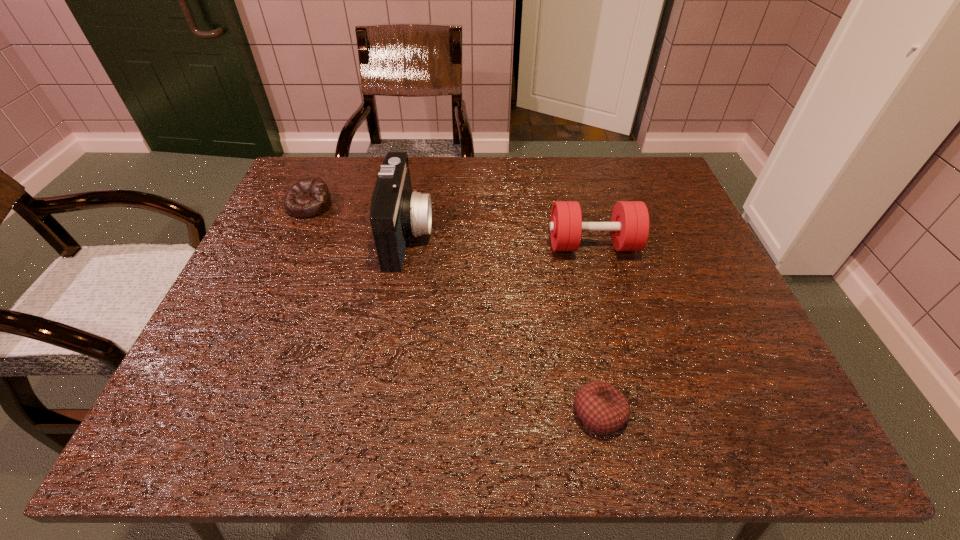
You are a GUI agent. You are given a task and a screenshot of the screen. Output one action in this format:
    pyautogui.click(x=<x>, y=<y>)
    Task: Click on the vacant space at the far left corner of the desktop
    The height and width of the screenshot is (540, 960).
    Given the screenshot: What is the action you would take?
    pyautogui.click(x=336, y=178)

You are a GUI agent. You are given a task and a screenshot of the screen. Output one action in this format:
    pyautogui.click(x=<x>, y=<y>)
    Task: Click on the free space at the near left corner of the desktop
    This screenshot has height=540, width=960.
    Given the screenshot: What is the action you would take?
    215,440

In the image, there is a desktop. At what (x,y) coordinates should I click in order to perform the action: click on vacant space at the far right corner. Please return your answer as a coordinate pair (x, y). Looking at the image, I should click on (615, 167).

Locate an element on the screen. The height and width of the screenshot is (540, 960). vacant space at the near right corner is located at coordinates tap(797, 433).

Identify the location of vacant region between the right beanbag and the leftmost object. (454, 309).

Locate an element on the screen. Image resolution: width=960 pixels, height=540 pixels. free space between the nearer beanbag and the camcorder is located at coordinates (504, 323).

You are a GUI agent. You are given a task and a screenshot of the screen. Output one action in this format:
    pyautogui.click(x=<x>, y=<y>)
    Task: Click on the free space between the right beanbag and the camcorder
    
    Given the screenshot: What is the action you would take?
    pyautogui.click(x=504, y=323)

Locate an element on the screen. Image resolution: width=960 pixels, height=540 pixels. free space between the left beanbag and the nearest object is located at coordinates (454, 309).

Where is `empty location between the farther beanbag and the nearer beanbag`? empty location between the farther beanbag and the nearer beanbag is located at coordinates click(x=454, y=309).

Identify the location of free space between the leftmost object and the camcorder. This screenshot has width=960, height=540. (359, 220).